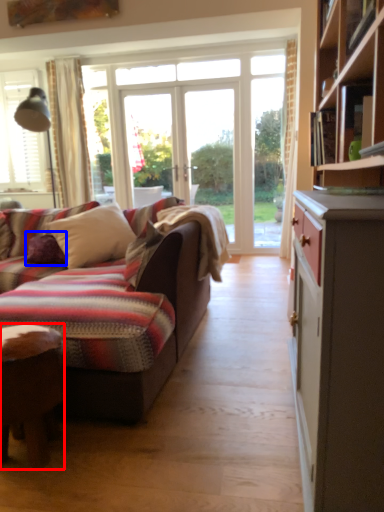
Question: Which object is further to the camera taking this photo, desk (highlighted by a red box) or pillow (highlighted by a blue box)?

Choices:
 (A) desk
 (B) pillow

Answer: (B)